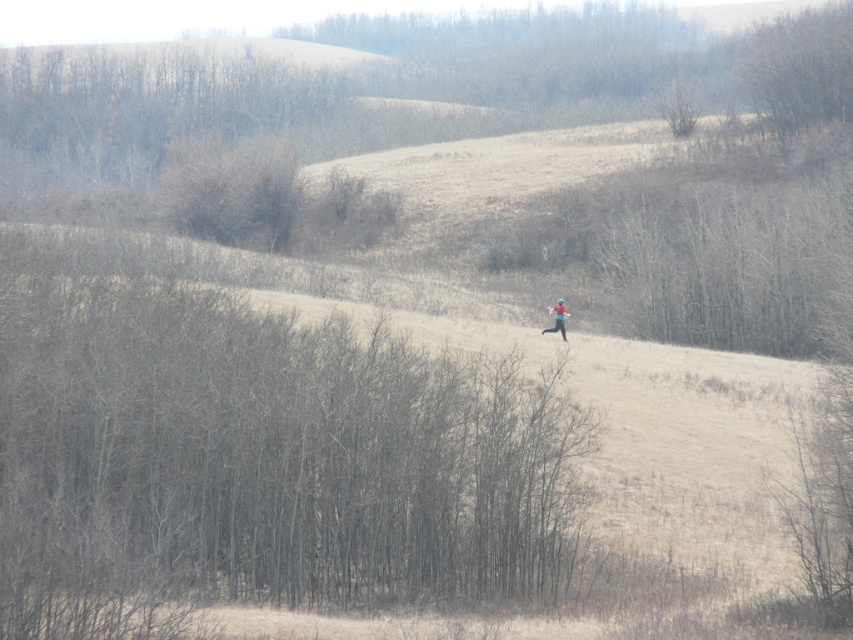
You are an animal looking for shelter in this landscape. Which of the two options would provide better protection from the cold wind? The brown matte tree at center or the bare branches at upper right?

The brown matte tree at center is bigger than the bare branches at upper right, so it would provide better protection from the cold wind.

You are standing in the landscape and want to take a photo of the blue fabric skier at center. However, the bare branches at upper right are blocking your view. Can you move to the left to avoid the branches?

The bare branches at upper right are positioned on the right side of the blue fabric skier at center. Moving to the left would allow you to avoid the branches and get a clear view of the skier.